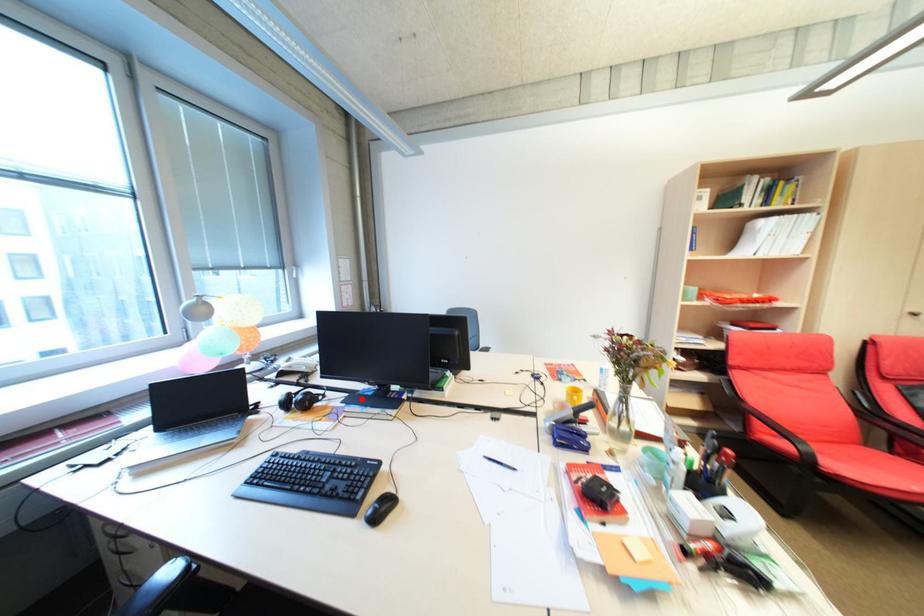
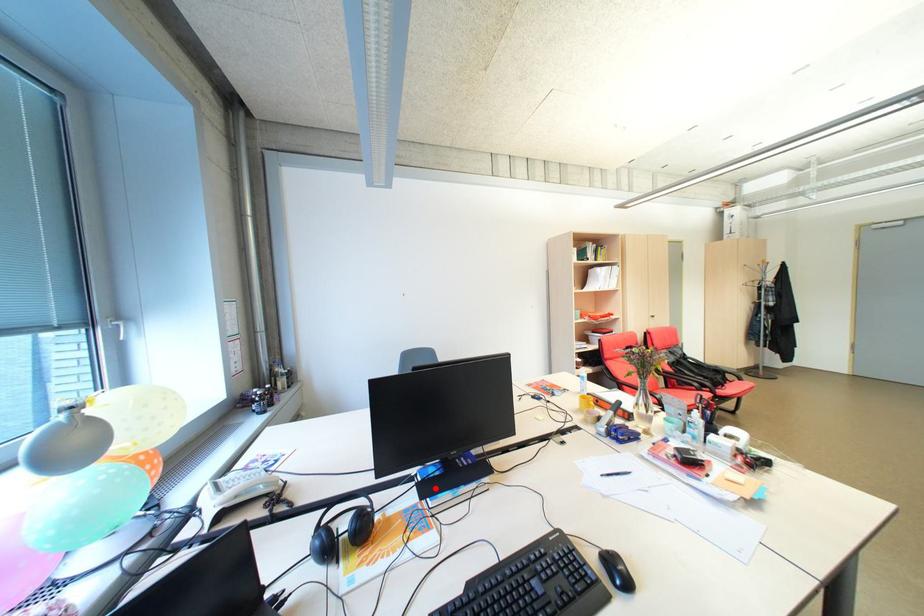
I am providing you with two images of the same scene from different viewpoints. A red point is marked on the first image and another point is marked on the second image. Does the point marked in image1 correspond to the same location as the one in image2?

Yes